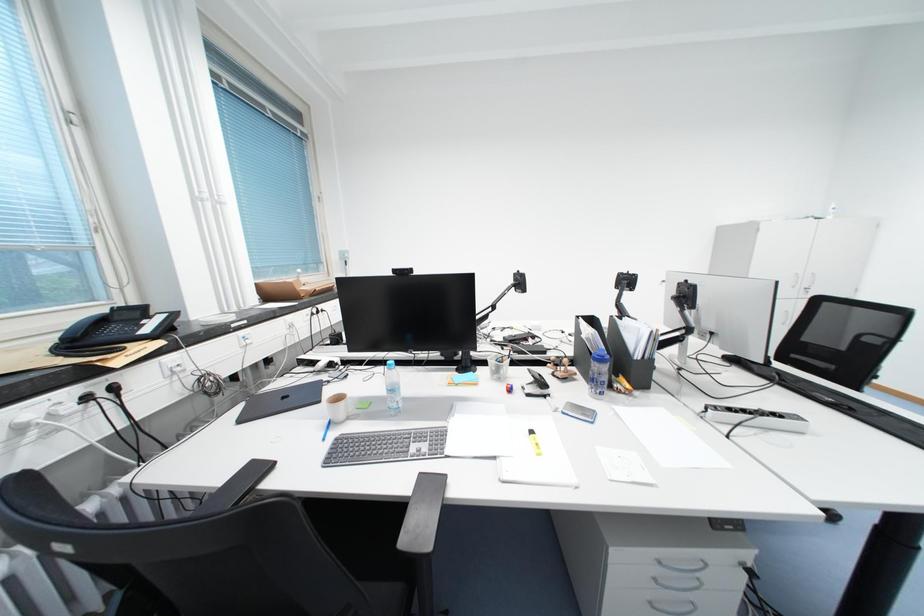
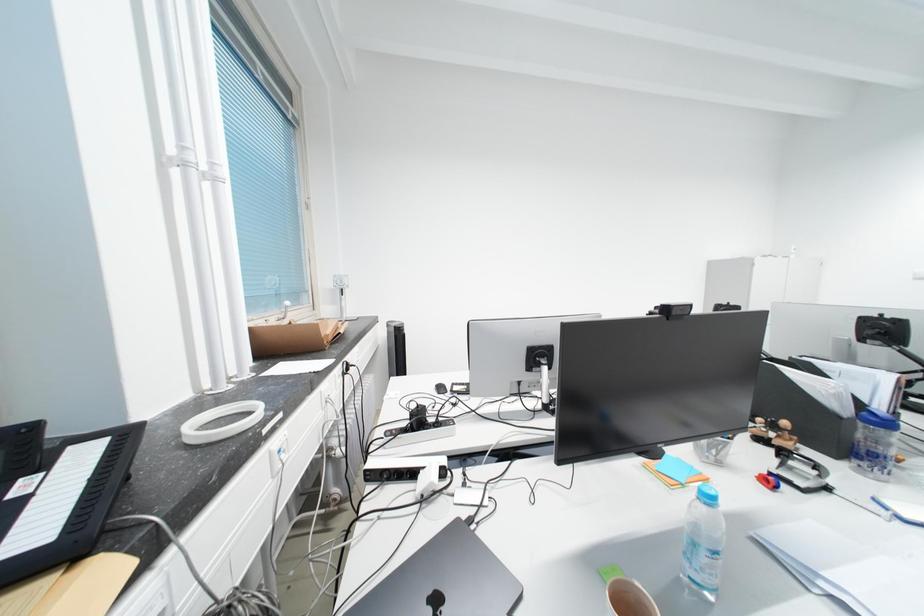
The images are taken continuously from a first-person perspective. In which direction are you moving?

The cameraman moved toward left, forward.